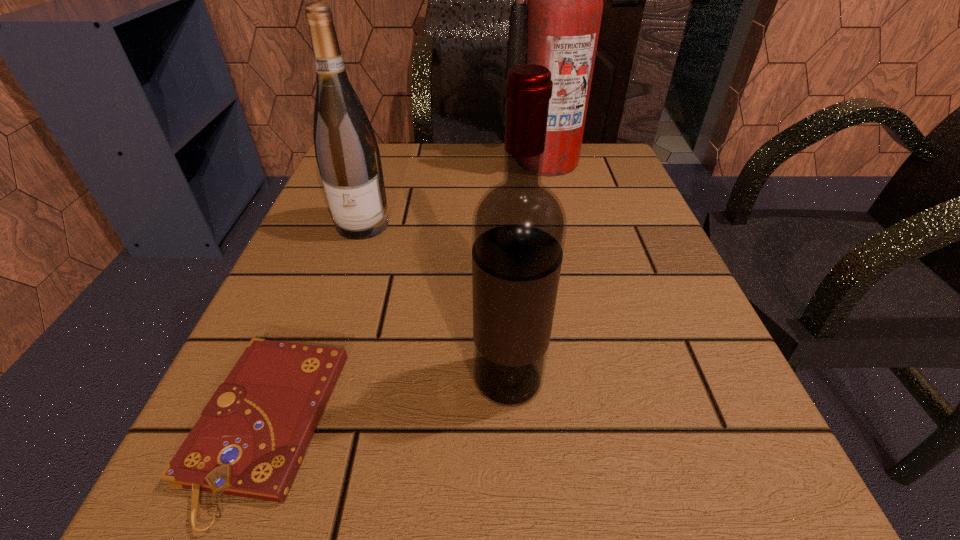
This screenshot has width=960, height=540. What are the coordinates of `vacant space that's between the farther wine bottle and the right wine bottle` in the screenshot? It's located at (436, 302).

Identify the location of free space that is in between the tallest object and the farther wine bottle. This screenshot has height=540, width=960. (455, 193).

Select which object appears as the third closest to the left wine bottle. Please provide its 2D coordinates. Your answer should be formatted as a tuple, i.e. [(x, y)], where the tuple contains the x and y coordinates of a point satisfying the conditions above.

[(519, 225)]

Identify the location of object that is the third closest to the shortest object. The image size is (960, 540). (558, 28).